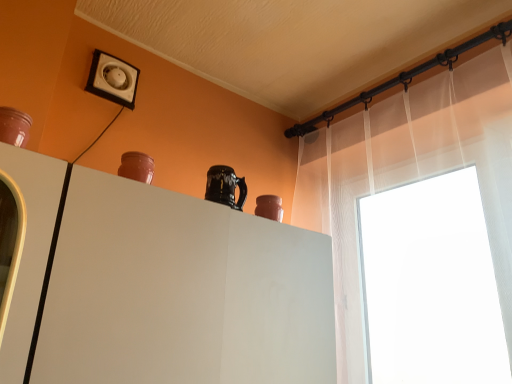
I want to click on white matte cabinet at center, so click(x=181, y=292).

From the picture: Measure the distance between point (279, 198) and camera.

Point (279, 198) is 1.38 meters away from camera.

The image size is (512, 384). Find the location of `matte clay vase at upper right, which ranks as the first vase in bottom-to-top order`. matte clay vase at upper right, which ranks as the first vase in bottom-to-top order is located at coordinates (269, 207).

At what (x,y) coordinates should I click in order to perform the action: click on matte brown vase at upper left, the 2th vase in the bottom-to-top sequence. Please return your answer as a coordinate pair (x, y). This screenshot has width=512, height=384. Looking at the image, I should click on (137, 167).

What's the angular difference between white plastic electric outlet at upper left and matte brown vase at upper left, which is counted as the second vase, starting from the right,'s facing directions?

white plastic electric outlet at upper left and matte brown vase at upper left, which is counted as the second vase, starting from the right, are facing 0.85 degrees away from each other.

In the scene shown: Is white plastic electric outlet at upper left far from matte brown vase at upper left, acting as the 1th vase starting from the top?

No.

From the image's perspective, relative to matte brown vase at upper left, the second vase positioned from the back, is white plastic electric outlet at upper left above or below?

From the image's perspective, white plastic electric outlet at upper left appears above matte brown vase at upper left, the second vase positioned from the back.

In the scene shown: From a real-world perspective, is white plastic electric outlet at upper left on matte brown vase at upper left, which is the 1th vase from front to back?

Yes, from a real-world perspective, white plastic electric outlet at upper left is above matte brown vase at upper left, which is the 1th vase from front to back.

Is white matte cabinet at center positioned in front of white plastic electric outlet at upper left?

Yes.

Looking at the image, does white matte cabinet at center seem bigger or smaller compared to white plastic electric outlet at upper left?

white matte cabinet at center is bigger than white plastic electric outlet at upper left.

In the scene shown: Which of these two, white matte cabinet at center or white plastic electric outlet at upper left, is thinner?

With smaller width is white plastic electric outlet at upper left.

Which point is more forward, (308, 343) or (101, 76)?

Point (308, 343)

Is white plastic electric outlet at upper left turned away from white matte cabinet at center?

No, white matte cabinet at center is not at the back of white plastic electric outlet at upper left.

Is white plastic electric outlet at upper left situated inside white matte cabinet at center or outside?

white plastic electric outlet at upper left is not inside white matte cabinet at center, it's outside.

Does white plastic electric outlet at upper left have a smaller size compared to white matte cabinet at center?

Yes, white plastic electric outlet at upper left is smaller than white matte cabinet at center.

Is white plastic electric outlet at upper left to the left of white matte cabinet at center from the viewer's perspective?

Correct, you'll find white plastic electric outlet at upper left to the left of white matte cabinet at center.

Which of these two, white matte cabinet at center or sheer white curtain at upper right, stands shorter?

white matte cabinet at center.

From a real-world perspective, is white matte cabinet at center physically below sheer white curtain at upper right?

Correct, in the physical world, white matte cabinet at center is lower than sheer white curtain at upper right.

Is white matte cabinet at center far from sheer white curtain at upper right?

That's not correct — white matte cabinet at center is a little close to sheer white curtain at upper right.

How far apart are white matte cabinet at center and sheer white curtain at upper right?

white matte cabinet at center is 24.00 inches away from sheer white curtain at upper right.

Is point (396, 104) less distant than point (127, 153)?

No, it is behind (127, 153).

Is sheer white curtain at upper right to the left or to the right of matte brown vase at upper left, the 1th vase positioned from the left, in the image?

Based on their positions, sheer white curtain at upper right is located to the right of matte brown vase at upper left, the 1th vase positioned from the left.

Is matte brown vase at upper left, the second vase positioned from the back, surrounded by sheer white curtain at upper right?

No, matte brown vase at upper left, the second vase positioned from the back, is not surrounded by sheer white curtain at upper right.

Considering the sizes of objects sheer white curtain at upper right and matte brown vase at upper left, the second vase positioned from the back, in the image provided, who is thinner, sheer white curtain at upper right or matte brown vase at upper left, the second vase positioned from the back,?

With smaller width is matte brown vase at upper left, the second vase positioned from the back.

Could you tell me if white matte cabinet at center is turned towards matte clay vase at upper right, which is counted as the 1th vase, starting from the right?

No.

From the picture: Is white matte cabinet at center bigger or smaller than matte clay vase at upper right, the 2th vase from the left?

In the image, white matte cabinet at center appears to be larger than matte clay vase at upper right, the 2th vase from the left.

In the scene shown: From a real-world perspective, which is physically above, white matte cabinet at center or matte clay vase at upper right, the first vase positioned from the back?

In real-world perspective, matte clay vase at upper right, the first vase positioned from the back, is above.

Which vase is the 2nd one when counting from the back of the white matte cabinet at center? Please provide its 2D coordinates.

[(269, 207)]

Considering the points (127, 159) and (338, 318), which point is in front, point (127, 159) or point (338, 318)?

Positioned in front is point (127, 159).

Could you measure the distance between matte brown vase at upper left, which is counted as the second vase, starting from the right, and sheer white curtain at upper right?

matte brown vase at upper left, which is counted as the second vase, starting from the right, and sheer white curtain at upper right are 36.87 inches apart.

Which object is further away from the camera, matte brown vase at upper left, the 1th vase positioned from the left, or sheer white curtain at upper right?

matte brown vase at upper left, the 1th vase positioned from the left.

From a real-world perspective, which vase is the 2nd one underneath the white plastic electric outlet at upper left? Please provide its 2D coordinates.

[(137, 167)]

The image size is (512, 384). In order to click on electric outlet on the left side of white matte cabinet at center in this screenshot , I will do `click(113, 79)`.

Which object lies further to the anchor point sheer white curtain at upper right, white plastic electric outlet at upper left or matte brown vase at upper left, acting as the 1th vase starting from the top?

white plastic electric outlet at upper left is further to sheer white curtain at upper right.

When comparing their distances from matte clay vase at upper right, which ranks as the first vase in bottom-to-top order, does white plastic electric outlet at upper left or matte brown vase at upper left, the second vase positioned from the back, seem further?

white plastic electric outlet at upper left.

Considering their positions, is white plastic electric outlet at upper left positioned closer to matte brown vase at upper left, which is counted as the second vase, starting from the right, than matte clay vase at upper right, the 2th vase from the left?

matte clay vase at upper right, the 2th vase from the left.

Based on their spatial positions, is sheer white curtain at upper right or white plastic electric outlet at upper left closer to white matte cabinet at center?

sheer white curtain at upper right.

From the image, which object appears to be farther from matte brown vase at upper left, the second vase positioned from the back, matte clay vase at upper right, the first vase positioned from the back, or white matte cabinet at center?

matte clay vase at upper right, the first vase positioned from the back, is further to matte brown vase at upper left, the second vase positioned from the back.

From the image, which object appears to be farther from matte clay vase at upper right, the 2th vase from the left, matte brown vase at upper left, which is the 1th vase from front to back, or sheer white curtain at upper right?

Based on the image, sheer white curtain at upper right appears to be further to matte clay vase at upper right, the 2th vase from the left.

Based on their spatial positions, is matte clay vase at upper right, acting as the 2th vase starting from the front, or sheer white curtain at upper right further from matte brown vase at upper left, the second vase positioned from the back?

sheer white curtain at upper right lies further to matte brown vase at upper left, the second vase positioned from the back, than the other object.

Considering their positions, is white matte cabinet at center positioned closer to matte brown vase at upper left, the second vase positioned from the back, than white plastic electric outlet at upper left?

white matte cabinet at center is positioned closer to the anchor matte brown vase at upper left, the second vase positioned from the back.

Where is `cabinetry between white plastic electric outlet at upper left and sheer white curtain at upper right in the horizontal direction`? cabinetry between white plastic electric outlet at upper left and sheer white curtain at upper right in the horizontal direction is located at coordinates (181, 292).

The image size is (512, 384). Find the location of `vase located between white matte cabinet at center and sheer white curtain at upper right in the left-right direction`. vase located between white matte cabinet at center and sheer white curtain at upper right in the left-right direction is located at coordinates (269, 207).

Identify the location of vase between matte brown vase at upper left, the second vase positioned from the back, and sheer white curtain at upper right from left to right. (269, 207).

Find the location of a particular element. vase between white matte cabinet at center and matte clay vase at upper right, which ranks as the first vase in bottom-to-top order, in the front-back direction is located at coordinates [x=137, y=167].